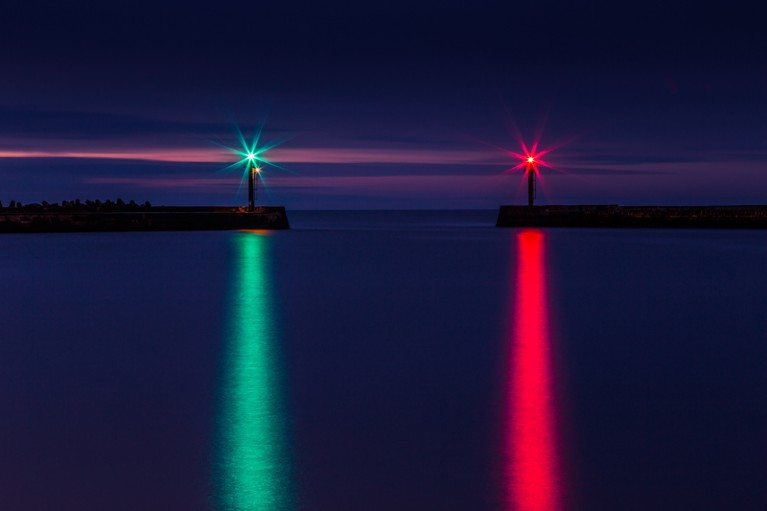
Identify the location of red lighting. The image size is (767, 511). (528, 161).